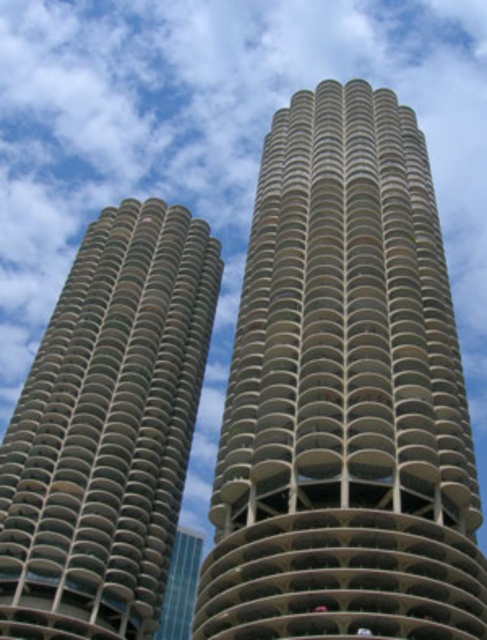
Can you confirm if beige concrete tower at center is taller than concrete textured building at left?

Indeed, beige concrete tower at center has a greater height compared to concrete textured building at left.

From the picture: Can you confirm if beige concrete tower at center is positioned to the right of concrete textured building at left?

Yes, beige concrete tower at center is to the right of concrete textured building at left.

Identify the location of beige concrete tower at center. (344, 396).